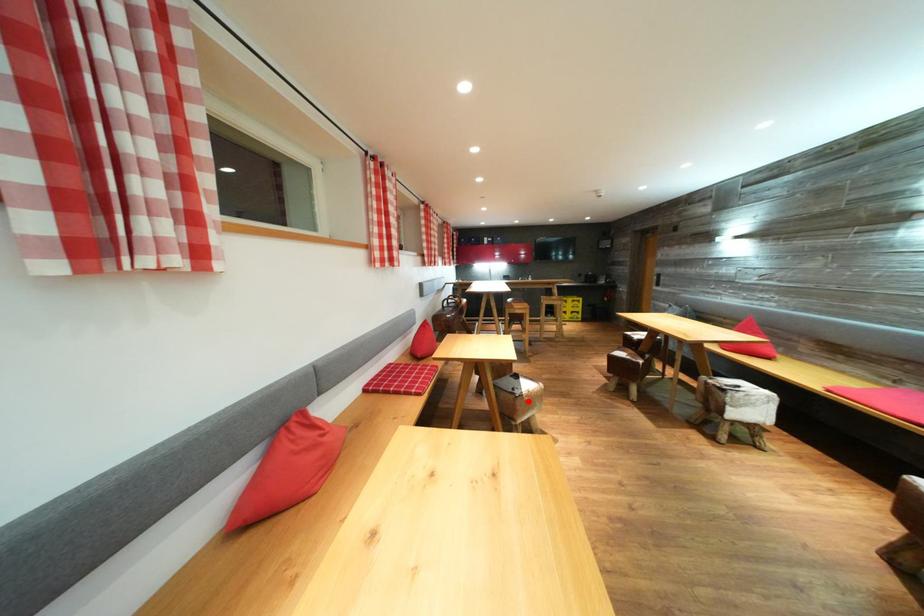
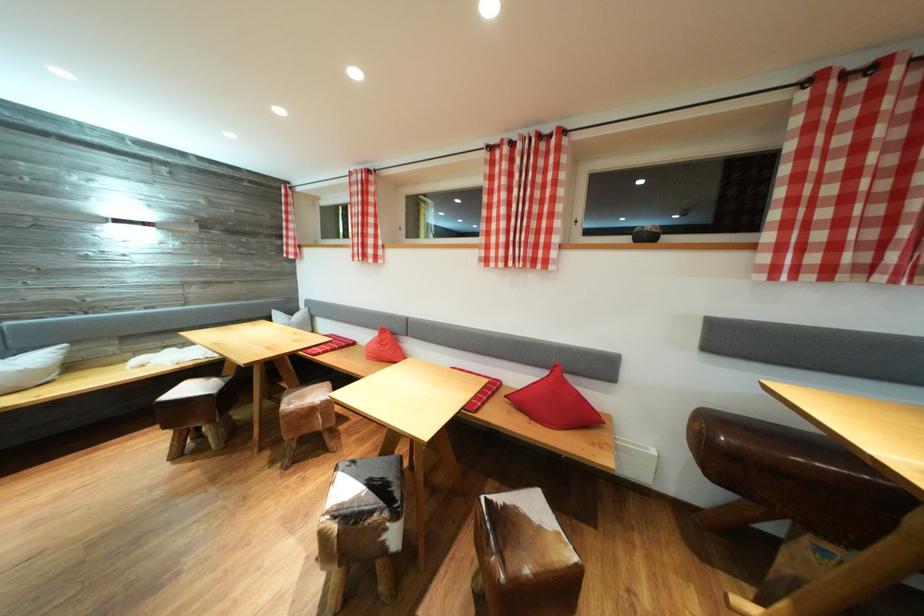
Question: I am providing you with two images of the same scene from different viewpoints. A red point is marked on the first image. Is the red point's position out of view in image 2?

Choices:
 (A) Yes
 (B) No

Answer: (A)